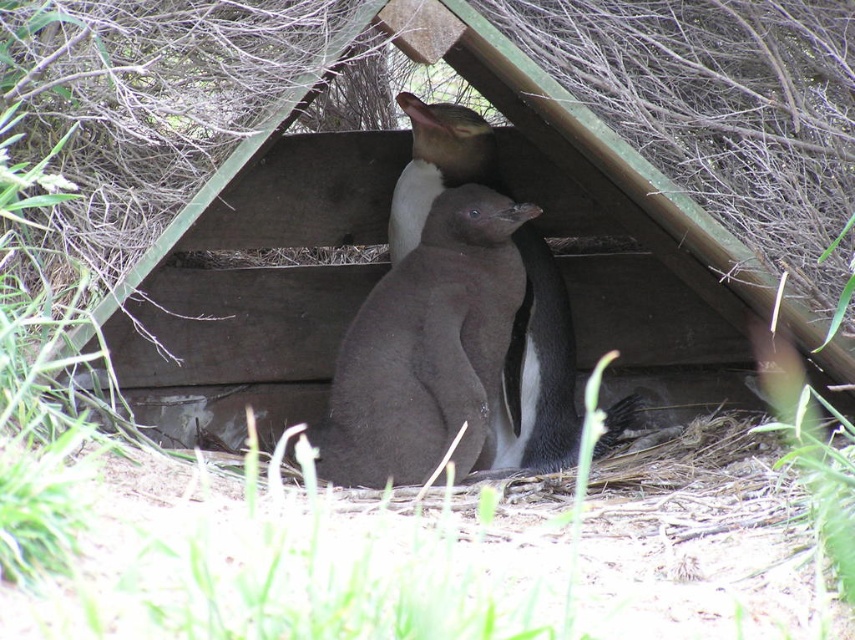
Which is more to the right, dark gray feathers at center or brown fuzzy penguin at center?

dark gray feathers at center

Is dark gray feathers at center taller than brown fuzzy penguin at center?

Correct, dark gray feathers at center is much taller as brown fuzzy penguin at center.

Between point (526, 282) and point (432, 128), which one is positioned in front?

Point (432, 128) is in front.

Locate an element on the screen. Image resolution: width=855 pixels, height=640 pixels. dark gray feathers at center is located at coordinates (537, 374).

This screenshot has height=640, width=855. What do you see at coordinates (428, 348) in the screenshot? I see `dark gray matte penguin at center` at bounding box center [428, 348].

How much distance is there between dark gray matte penguin at center and brown fuzzy penguin at center?

15.13 inches

Identify the location of dark gray matte penguin at center. (428, 348).

Image resolution: width=855 pixels, height=640 pixels. In order to click on dark gray matte penguin at center in this screenshot , I will do `click(428, 348)`.

Does dark gray matte penguin at center have a larger size compared to dark gray feathers at center?

Incorrect, dark gray matte penguin at center is not larger than dark gray feathers at center.

Is point (361, 387) behind point (559, 400)?

That is False.

Measure the distance between point (429, 288) and camera.

Point (429, 288) is 9.98 feet from camera.

Where is `dark gray matte penguin at center`? The height and width of the screenshot is (640, 855). dark gray matte penguin at center is located at coordinates (428, 348).